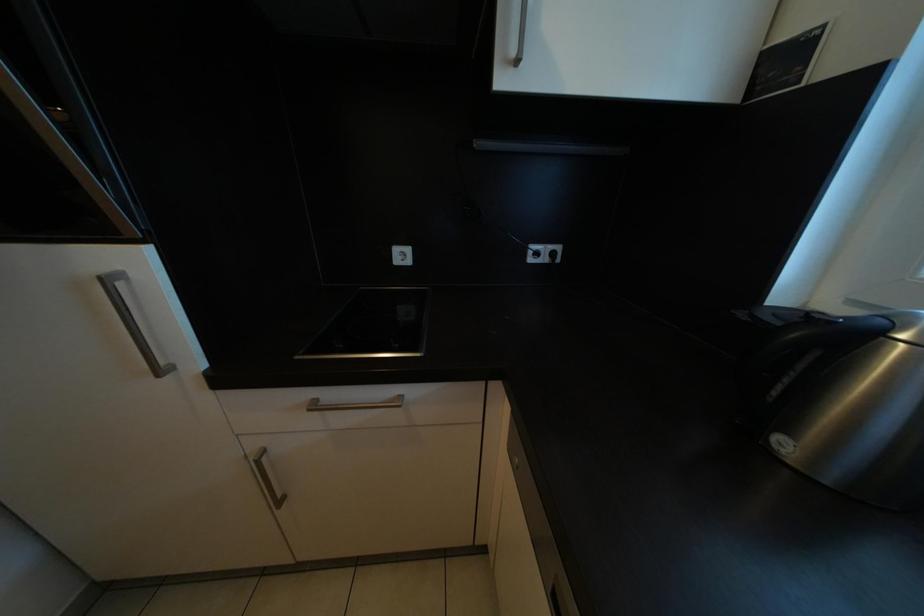
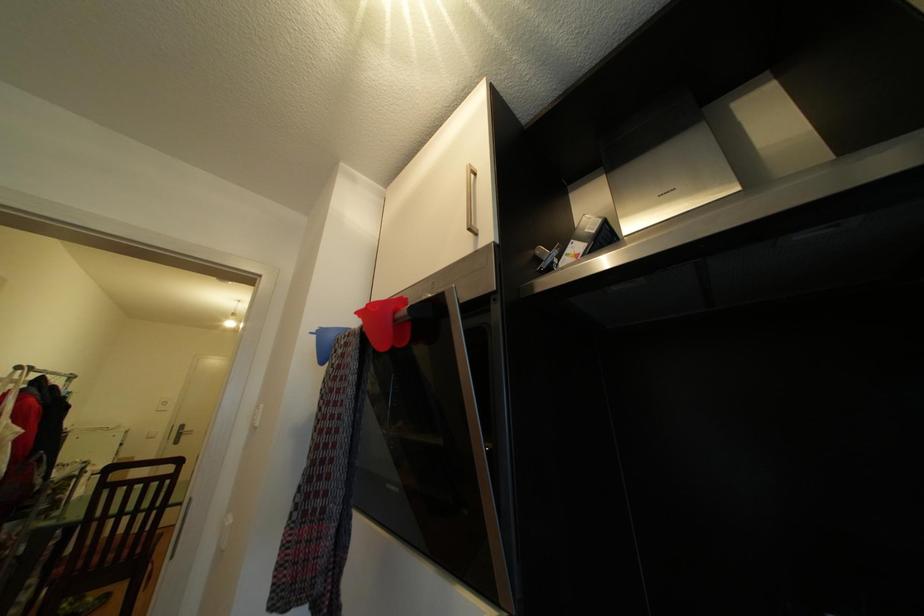
The images are taken continuously from a first-person perspective. In which direction is your viewpoint rotating?

The rotation direction of the camera is left-up.